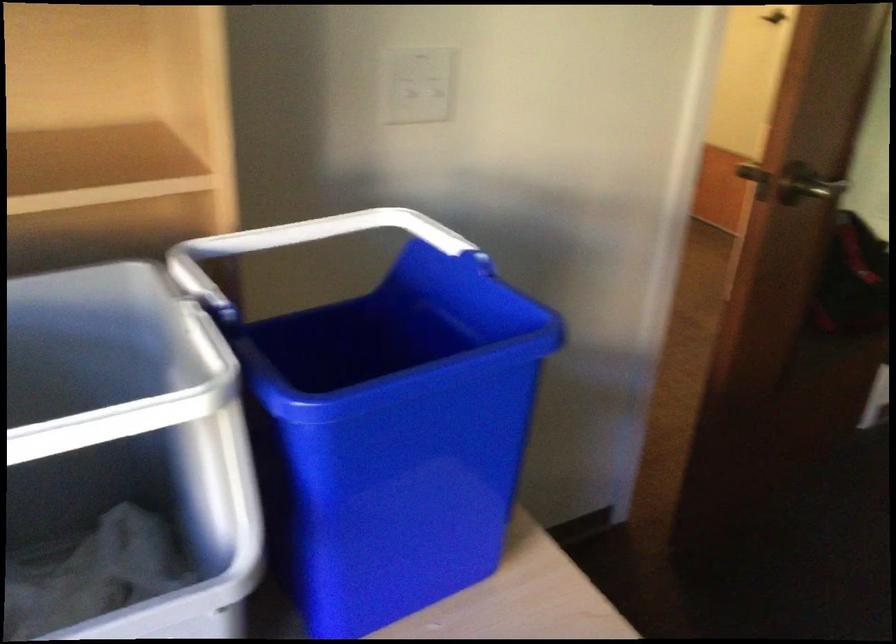
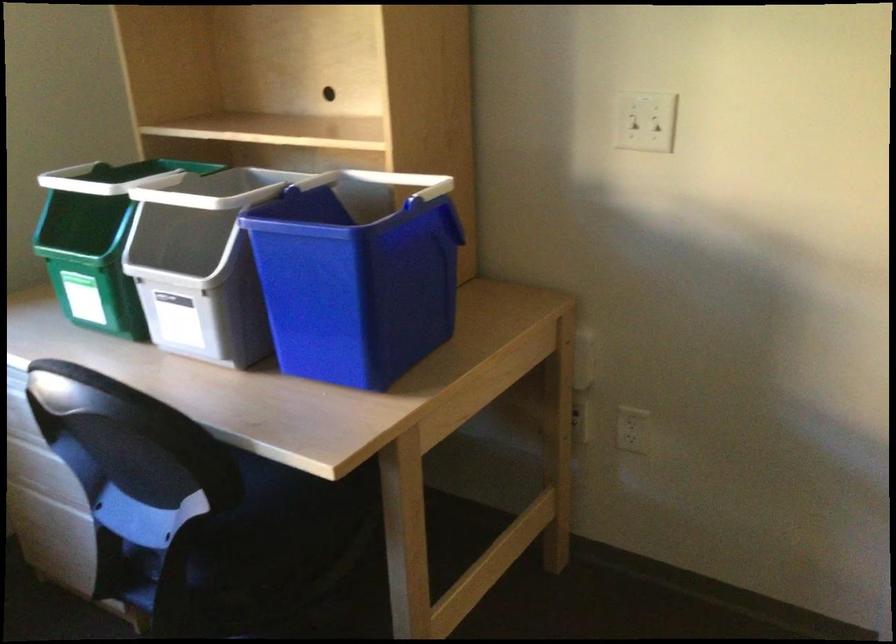
Where in the second image is the point corresponding to pixel 409 79 from the first image?

(643, 118)